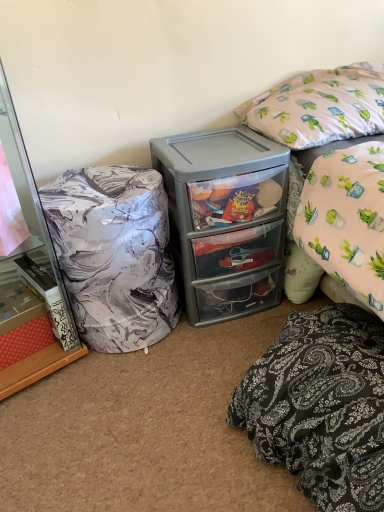
Question: Is marble-patterned bean bag at left positioned in front of marble-patterned fabric at left?

Choices:
 (A) yes
 (B) no

Answer: (B)

Question: Is marble-patterned bean bag at left wider than marble-patterned fabric at left?

Choices:
 (A) no
 (B) yes

Answer: (A)

Question: From the image's perspective, is marble-patterned bean bag at left beneath marble-patterned fabric at left?

Choices:
 (A) yes
 (B) no

Answer: (A)

Question: Is marble-patterned bean bag at left facing towards marble-patterned fabric at left?

Choices:
 (A) yes
 (B) no

Answer: (B)

Question: Considering the relative sizes of marble-patterned bean bag at left and marble-patterned fabric at left in the image provided, is marble-patterned bean bag at left taller than marble-patterned fabric at left?

Choices:
 (A) no
 (B) yes

Answer: (A)

Question: From a real-world perspective, is marble-patterned bean bag at left physically below marble-patterned fabric at left?

Choices:
 (A) yes
 (B) no

Answer: (A)

Question: Considering the relative sizes of gray plastic storage at center and marble-patterned bean bag at left in the image provided, is gray plastic storage at center shorter than marble-patterned bean bag at left?

Choices:
 (A) yes
 (B) no

Answer: (B)

Question: Does gray plastic storage at center have a larger size compared to marble-patterned bean bag at left?

Choices:
 (A) no
 (B) yes

Answer: (B)

Question: Considering the relative sizes of gray plastic storage at center and marble-patterned bean bag at left in the image provided, is gray plastic storage at center thinner than marble-patterned bean bag at left?

Choices:
 (A) no
 (B) yes

Answer: (A)

Question: Is gray plastic storage at center positioned with its back to marble-patterned bean bag at left?

Choices:
 (A) no
 (B) yes

Answer: (A)

Question: Does gray plastic storage at center turn towards marble-patterned bean bag at left?

Choices:
 (A) no
 (B) yes

Answer: (A)

Question: From the image's perspective, does gray plastic storage at center appear lower than marble-patterned bean bag at left?

Choices:
 (A) no
 (B) yes

Answer: (A)

Question: Is the depth of gray plastic storage at center greater than that of pink fabric pillow at upper right, acting as the 1th pillow starting from the top?

Choices:
 (A) no
 (B) yes

Answer: (B)